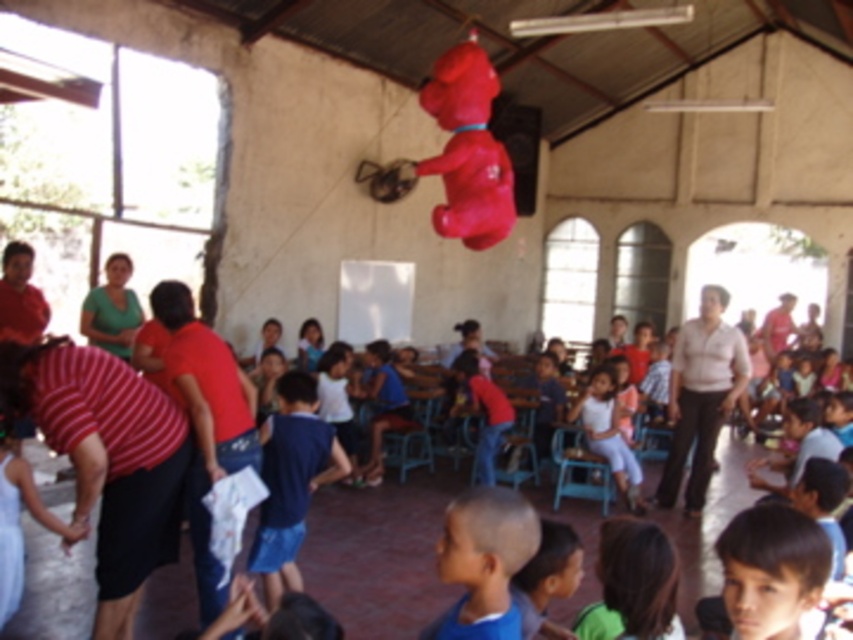
Can you confirm if rubber dog at upper center is shorter than white matte pants at center?

No.

Can you confirm if rubber dog at upper center is positioned above white matte pants at center?

Yes.

Is point (463, 90) positioned after point (635, 472)?

No, it is in front of (635, 472).

At what (x,y) coordinates should I click in order to perform the action: click on rubber dog at upper center. Please return your answer as a coordinate pair (x, y). Looking at the image, I should click on (467, 148).

Is point (457, 140) closer to viewer compared to point (9, 499)?

No, it is behind (9, 499).

What do you see at coordinates (467, 148) in the screenshot?
I see `rubber dog at upper center` at bounding box center [467, 148].

Identify the location of rubber dog at upper center. Image resolution: width=853 pixels, height=640 pixels. (467, 148).

Does brown hair at lower right appear on the left side of white cotton dress at lower left?

Incorrect, brown hair at lower right is not on the left side of white cotton dress at lower left.

Which is in front, point (723, 572) or point (21, 493)?

Point (723, 572) is more forward.

Locate an element on the screen. brown hair at lower right is located at coordinates (770, 570).